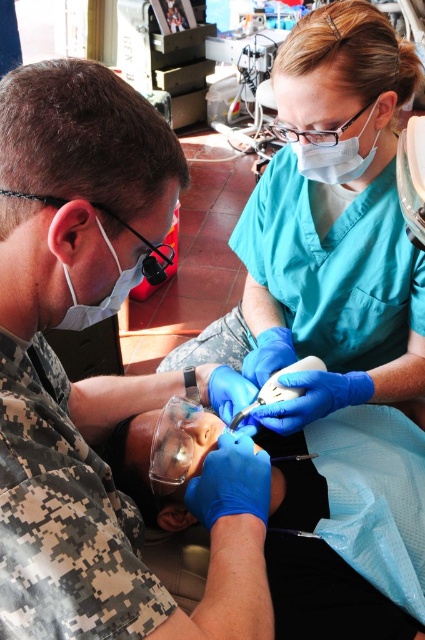
Question: Is blue rubber gloves at lower center smaller than matte white mask at left?

Choices:
 (A) no
 (B) yes

Answer: (A)

Question: Which point appears farthest from the camera in this image?

Choices:
 (A) (241, 410)
 (B) (337, 1)
 (C) (82, 605)
 (D) (362, 125)

Answer: (A)

Question: Does white fabric mask at center have a smaller size compared to white plastic dental drill at center?

Choices:
 (A) yes
 (B) no

Answer: (B)

Question: Which is nearer to the white fabric mask at center?

Choices:
 (A) teal fabric scrubs at center
 (B) white plastic dental drill at center
 (C) blue rubber gloves at lower center
 (D) matte white mask at left

Answer: (A)

Question: Which object appears farthest from the camera in this image?

Choices:
 (A) matte white mask at left
 (B) blue rubber gloves at lower center
 (C) white fabric mask at center

Answer: (C)

Question: Is matte white mask at left closer to the viewer compared to white plastic dental drill at center?

Choices:
 (A) no
 (B) yes

Answer: (B)